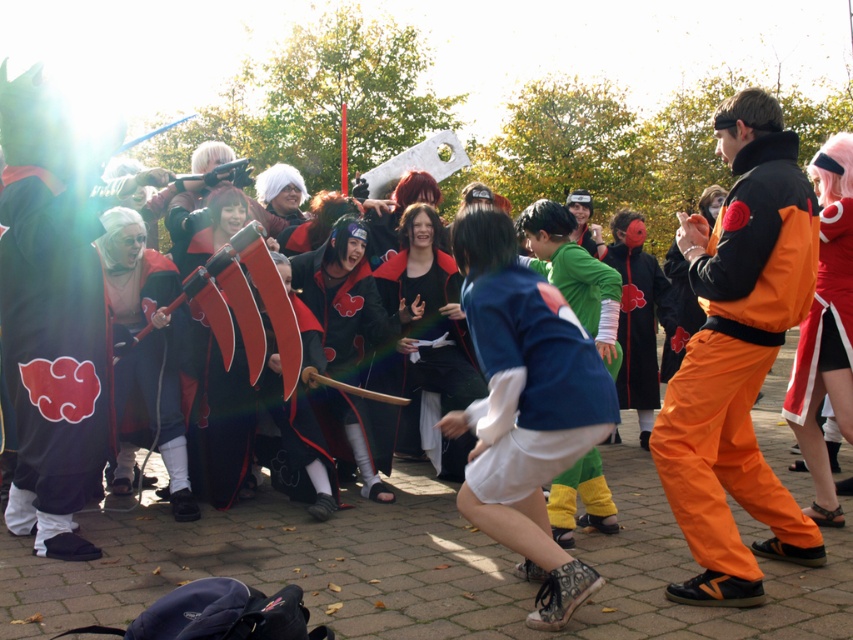
Is orange cotton pants at right shorter than white cotton shirt at center?

No.

Does orange cotton pants at right come in front of white cotton shirt at center?

No, it is behind white cotton shirt at center.

Where is `orange cotton pants at right`? orange cotton pants at right is located at coordinates (738, 356).